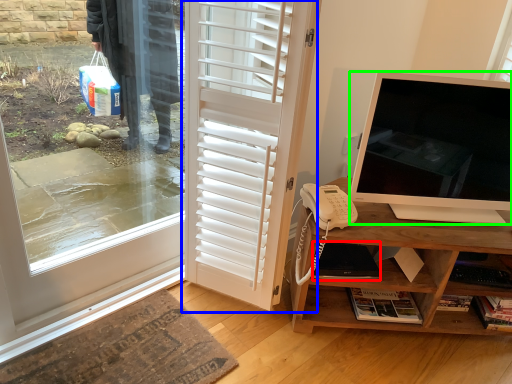
Question: Estimate the real-world distances between objects in this image. Which object is farther from laptop (highlighted by a red box), door (highlighted by a blue box) or television (highlighted by a green box)?

Choices:
 (A) door
 (B) television

Answer: (A)